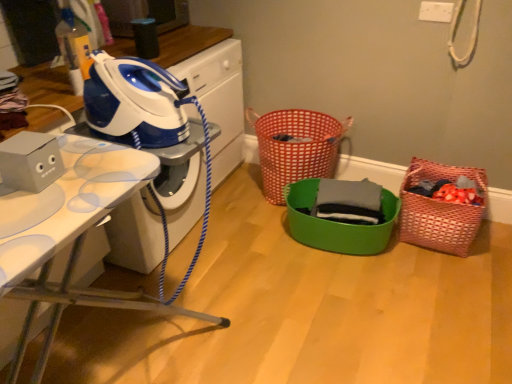
Question: Which direction should I rotate to look at red woven basket at center, the first basket in the left-to-right sequence?

Choices:
 (A) left
 (B) right

Answer: (B)

Question: Could you tell me if green plastic basket at center, which is the 2th basket from right to left, is facing gray matte cardboard box at left, the 2th appliance from the top?

Choices:
 (A) no
 (B) yes

Answer: (A)

Question: Is green plastic basket at center, which is the 2th basket from right to left, bigger than gray matte cardboard box at left, the 2th appliance from the top?

Choices:
 (A) yes
 (B) no

Answer: (A)

Question: Is green plastic basket at center, which is the 2th basket from right to left, to the left of gray matte cardboard box at left, the 2th appliance in the back-to-front sequence, from the viewer's perspective?

Choices:
 (A) no
 (B) yes

Answer: (A)

Question: Does green plastic basket at center, marked as the 2th basket in a left-to-right arrangement, have a greater height compared to gray matte cardboard box at left, the 1th appliance when ordered from front to back?

Choices:
 (A) yes
 (B) no

Answer: (A)

Question: From a real-world perspective, is green plastic basket at center, marked as the 2th basket in a left-to-right arrangement, physically above gray matte cardboard box at left, the 2th appliance in the back-to-front sequence?

Choices:
 (A) yes
 (B) no

Answer: (B)

Question: Is green plastic basket at center, marked as the 2th basket in a left-to-right arrangement, in contact with gray matte cardboard box at left, which appears as the 1th appliance when ordered from the bottom?

Choices:
 (A) yes
 (B) no

Answer: (B)

Question: Is gray matte cardboard box at left, the 2th appliance in the back-to-front sequence, positioned far away from green plastic basket at center, marked as the 2th basket in a left-to-right arrangement?

Choices:
 (A) yes
 (B) no

Answer: (A)

Question: Is gray matte cardboard box at left, which appears as the 1th appliance when ordered from the bottom, at the left side of green plastic basket at center, which is the 2th basket from right to left?

Choices:
 (A) yes
 (B) no

Answer: (A)

Question: Is gray matte cardboard box at left, the 2th appliance from the top, closer to camera compared to green plastic basket at center, which is the 2th basket from right to left?

Choices:
 (A) yes
 (B) no

Answer: (A)

Question: Is gray matte cardboard box at left, which appears as the 1th appliance when ordered from the bottom, bigger than green plastic basket at center, marked as the 2th basket in a left-to-right arrangement?

Choices:
 (A) yes
 (B) no

Answer: (B)

Question: Considering the relative sizes of gray matte cardboard box at left, the 2th appliance in the back-to-front sequence, and green plastic basket at center, marked as the 2th basket in a left-to-right arrangement, in the image provided, is gray matte cardboard box at left, the 2th appliance in the back-to-front sequence, taller than green plastic basket at center, marked as the 2th basket in a left-to-right arrangement,?

Choices:
 (A) no
 (B) yes

Answer: (A)

Question: Are gray matte cardboard box at left, the 1th appliance when ordered from front to back, and green plastic basket at center, marked as the 2th basket in a left-to-right arrangement, making contact?

Choices:
 (A) no
 (B) yes

Answer: (A)

Question: Is the surface of green plastic basket at center, which is the 2th basket from right to left, in direct contact with blue/white plastic iron at upper left, which appears as the first appliance when viewed from the top?

Choices:
 (A) no
 (B) yes

Answer: (A)